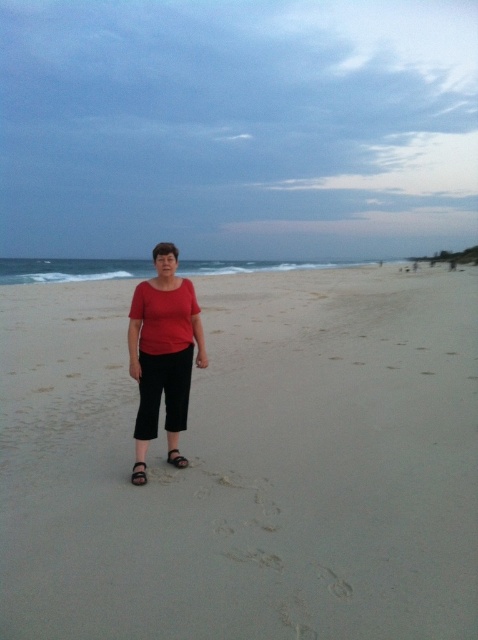
You are standing on the beach and want to place a seashell on the ground in front of you. The sandy at center is where you are standing. Can you place the seashell on the ground in front of your black leather sandal at lower center?

The sandy at center is located above the black leather sandal at lower center, so yes, you can place the seashell on the ground in front of your black leather sandal at lower center since the sand is above the sandal.

You are a photographer trying to capture the perfect shot of the beach scene. You notice the matte red blouse at center and the black leather sandal at center. Which object should you focus on first if you want to ensure both are in frame without needing to adjust your camera angle?

The matte red blouse at center is taller than the black leather sandal at center, so focusing on the taller blouse first will ensure both are within the frame since the sandal is shorter and positioned below it.